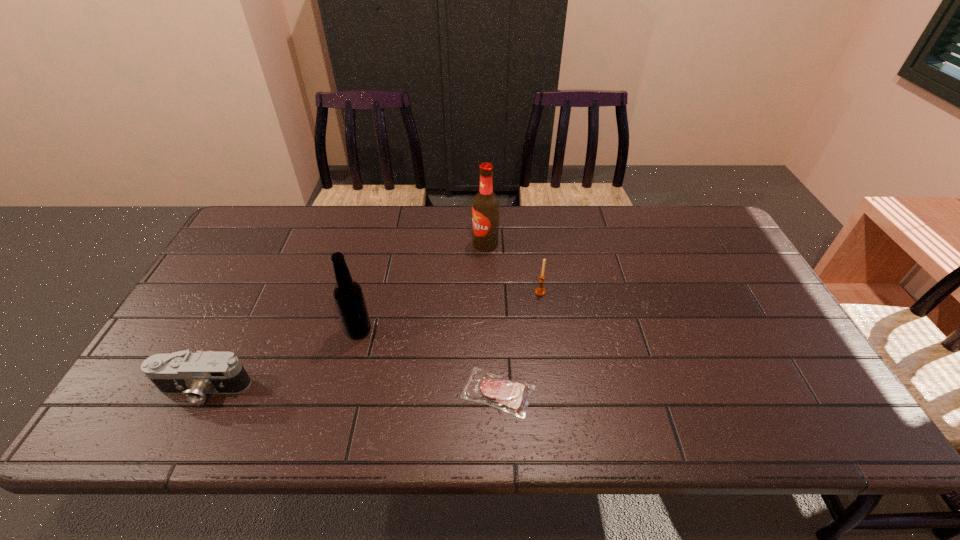
Find the location of a particular element. The height and width of the screenshot is (540, 960). free spot between the leftmost object and the candle_holder is located at coordinates (372, 341).

Find the location of a particular element. unoccupied position between the steak and the third shortest object is located at coordinates (519, 342).

Where is `free spot between the rightmost object and the nearer beer bottle`? free spot between the rightmost object and the nearer beer bottle is located at coordinates (449, 311).

Identify the location of free space between the steak and the camera. (351, 390).

Find the location of `the closest object to the fourth tallest object`. the closest object to the fourth tallest object is located at coordinates (348, 295).

Point out which object is positioned as the third nearest to the camera. Please provide its 2D coordinates. Your answer should be formatted as a tuple, i.e. [(x, y)], where the tuple contains the x and y coordinates of a point satisfying the conditions above.

[(485, 206)]

Where is `vacant area that satisfies the following two spatial constraints: 1. on the back side of the second object from left to right; 2. on the right side of the farther beer bottle`? The width and height of the screenshot is (960, 540). vacant area that satisfies the following two spatial constraints: 1. on the back side of the second object from left to right; 2. on the right side of the farther beer bottle is located at coordinates (380, 244).

The width and height of the screenshot is (960, 540). What are the coordinates of `free location that satisfies the following two spatial constraints: 1. on the front side of the farther beer bottle; 2. on the left side of the third shortest object` in the screenshot? It's located at (486, 292).

This screenshot has width=960, height=540. I want to click on blank area in the image that satisfies the following two spatial constraints: 1. on the back side of the shortest object; 2. on the left side of the second farthest object, so click(494, 292).